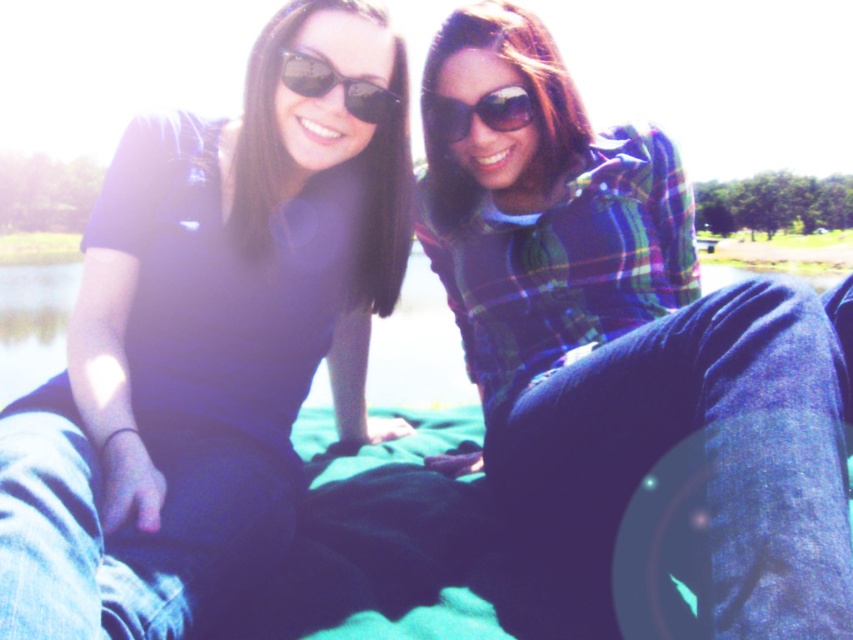
You are standing in front of the scene and want to take a closer look at the matte black sunglasses at upper center. Considering the distance between you and the sunglasses, can you comfortably reach out and touch them without moving your feet?

The matte black sunglasses at upper center are 4.96 feet away from the viewer, which is approximately 5 feet. Since this distance is beyond typical arm length, you cannot comfortably reach out and touch them without moving your feet.

You are a photographer setting up a shot of the two people in the scene. You want to ensure the matte black shirt at center and the green grass at lower left are both visible in the frame. Based on their positions, which object is closer to the bottom edge of the image?

The matte black shirt at center is below green grass at lower left, so it is closer to the bottom edge of the image.

You are a photographer planning to take a group photo of the two people in the scene. The minimum distance required between the subjects and the camera to avoid blurring is 50 feet. Can you position the camera so that both the matte black sunglasses at upper center and the green grass at lower left are within the required distance?

The matte black sunglasses at upper center and green grass at lower left are 55.39 feet apart. Since the minimum distance required is 50 feet, the camera cannot be positioned to keep both within the required distance as the separation exceeds the threshold.